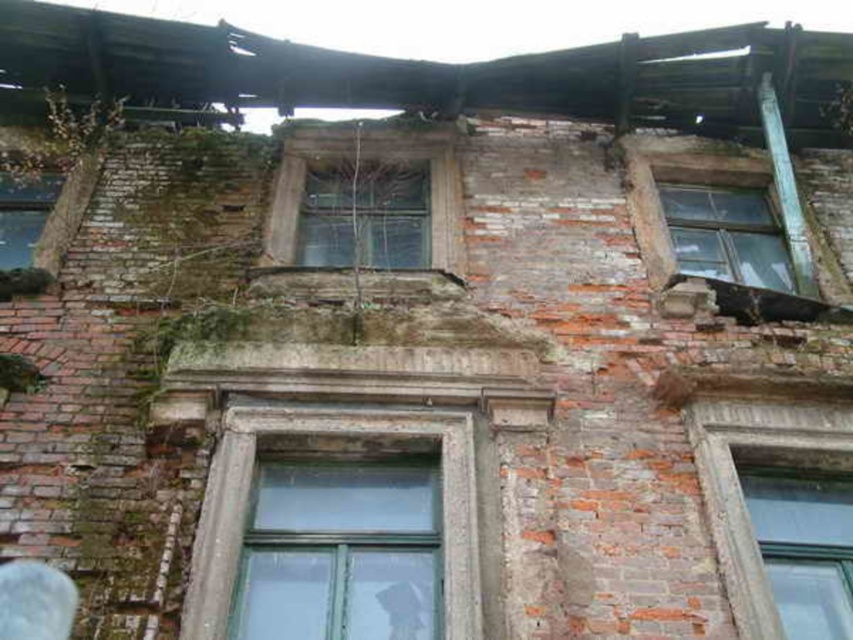
Is point (318, 513) closer to camera compared to point (412, 225)?

That is True.

Which is in front, point (294, 624) or point (331, 176)?

Point (294, 624)

The width and height of the screenshot is (853, 640). What do you see at coordinates (341, 552) in the screenshot?
I see `clear glass window at center` at bounding box center [341, 552].

Identify the location of clear glass window at center. This screenshot has width=853, height=640. (341, 552).

Which is above, transparent glass window at center or transparent glass window at upper left?

Positioned higher is transparent glass window at center.

Between point (329, 244) and point (21, 189), which one is positioned in front?

Point (329, 244)

The height and width of the screenshot is (640, 853). Identify the location of transparent glass window at center. (364, 216).

Is clear glass window at center wider than transparent glass window at upper left?

Yes.

Is clear glass window at center above transparent glass window at upper left?

Incorrect, clear glass window at center is not positioned above transparent glass window at upper left.

Between point (299, 608) and point (16, 244), which one is positioned behind?

Point (16, 244)

Where is `clear glass window at center`? clear glass window at center is located at coordinates (341, 552).